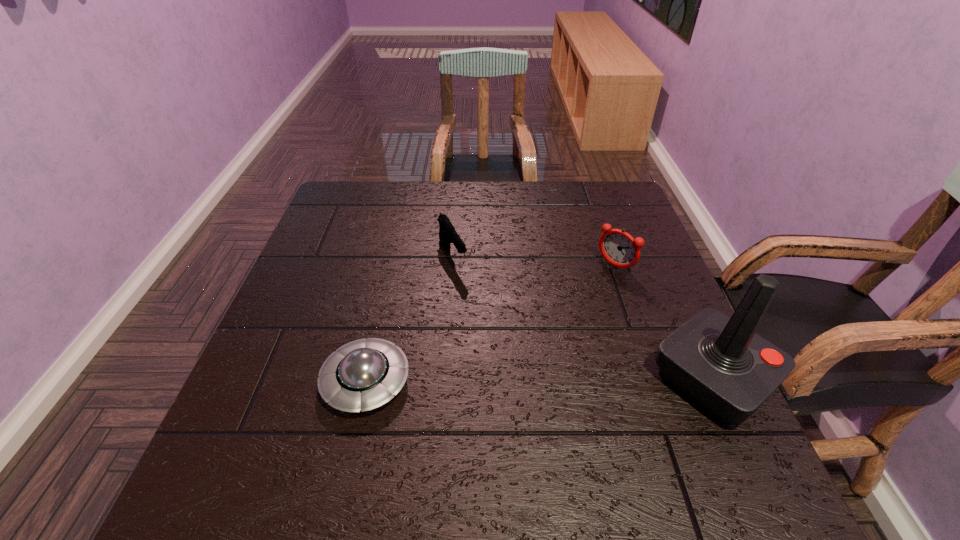
Find the location of a particular element. The height and width of the screenshot is (540, 960). vacant space on the desktop that is between the leftmost object and the tallest object and is positioned on the front-facing side of the alarm clock is located at coordinates (500, 380).

You are a GUI agent. You are given a task and a screenshot of the screen. Output one action in this format:
    pyautogui.click(x=<x>, y=<y>)
    Task: Click on the free space on the desktop that is between the saucer and the joystick and is positioned on the front-facing side of the second shortest object
    This screenshot has width=960, height=540.
    Given the screenshot: What is the action you would take?
    pyautogui.click(x=530, y=380)